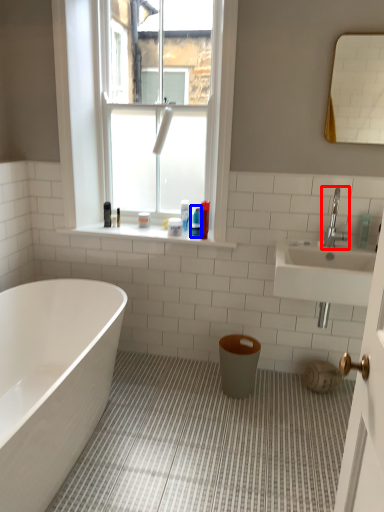
Question: Which point is further to the camera, tap (highlighted by a red box) or toiletry (highlighted by a blue box)?

Choices:
 (A) tap
 (B) toiletry

Answer: (B)